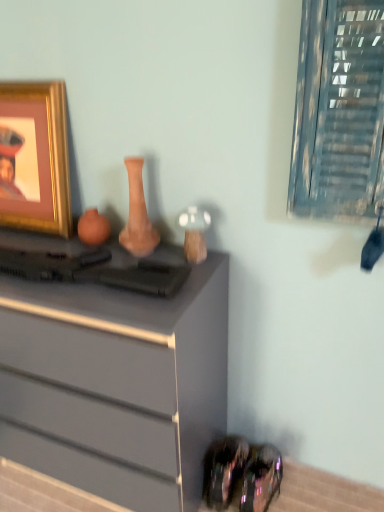
I want to click on free location to the right of matte clay vase at center, so click(178, 252).